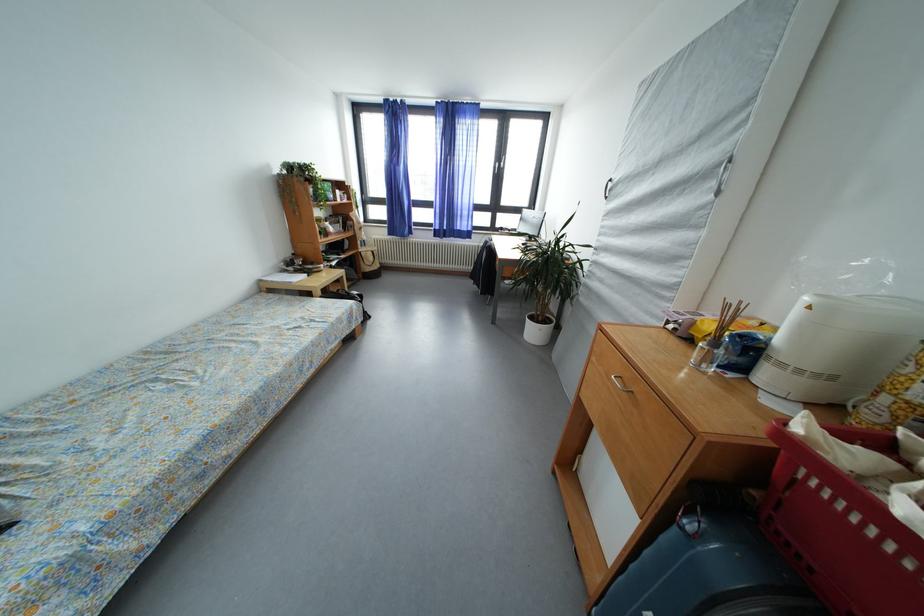
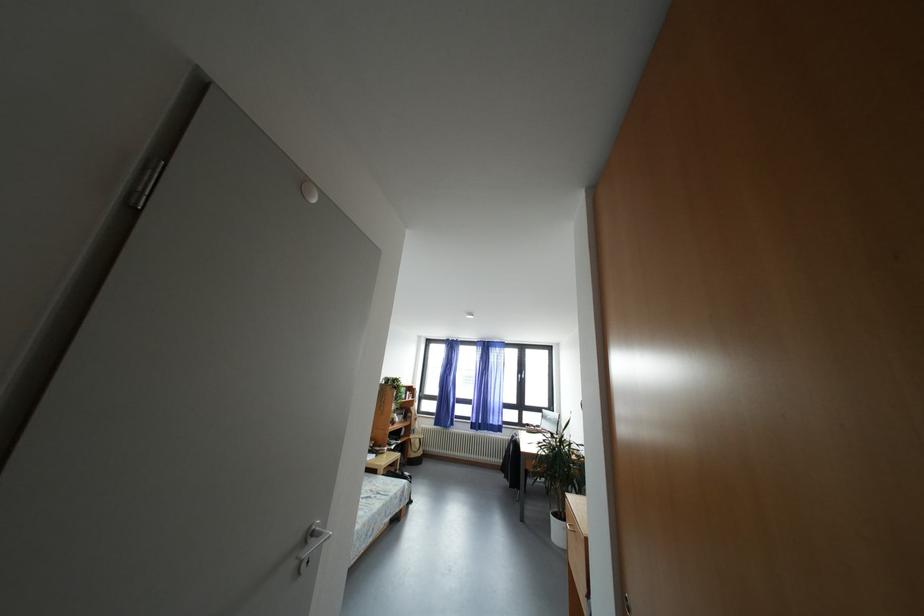
Locate, in the second image, the point that corresponds to [444,245] in the first image.

(480, 437)